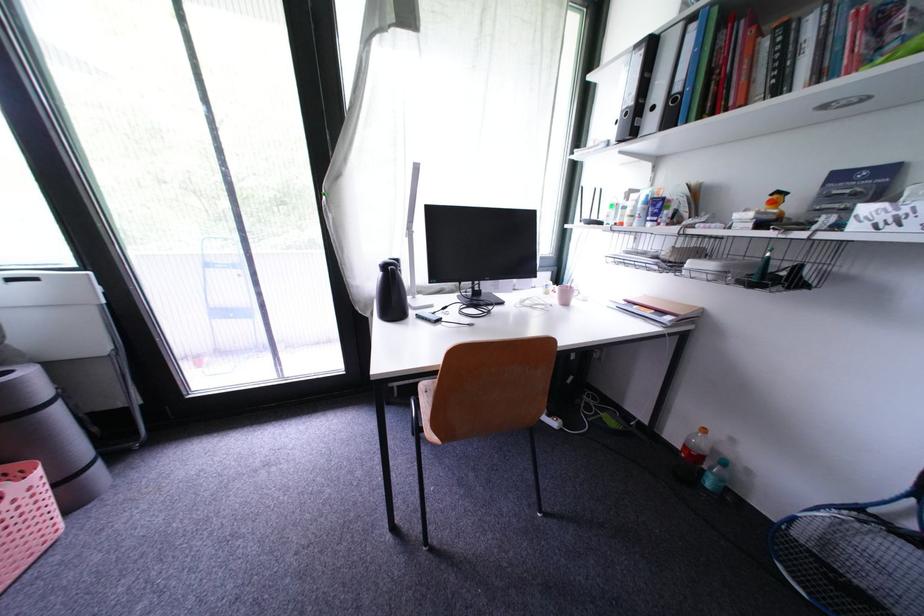
Describe the element at coordinates (578, 294) in the screenshot. I see `a pink mug handle` at that location.